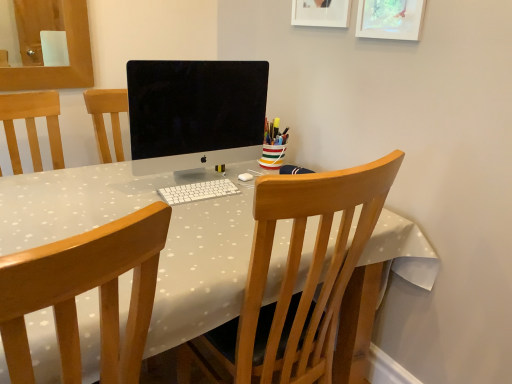
Where is `free spot in front of sleek silver monitor at center`? The image size is (512, 384). free spot in front of sleek silver monitor at center is located at coordinates pyautogui.click(x=202, y=216).